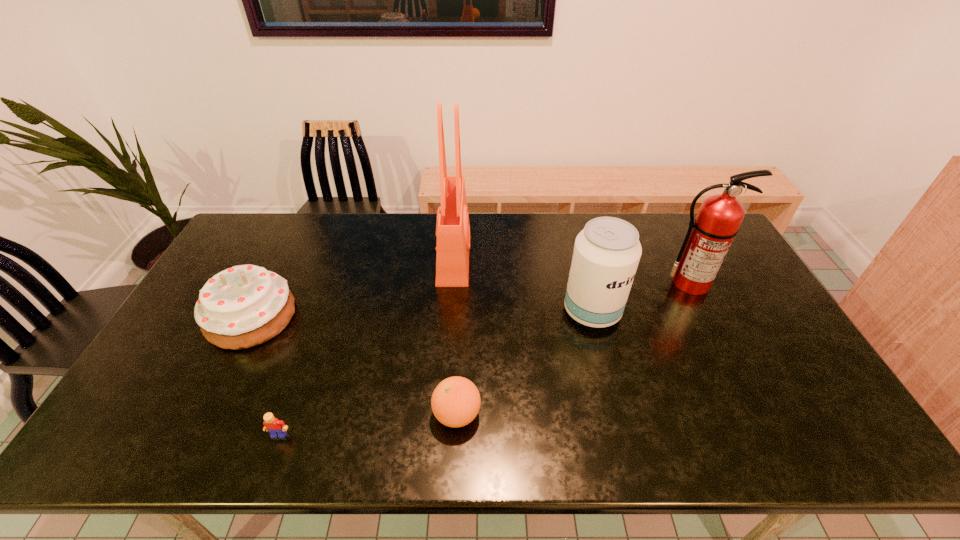
This screenshot has width=960, height=540. Identify the location of blank area located on the logo side of the tote bag. (538, 255).

Identify the location of vacant position located 0.370m at the nozzle of the fire extinguisher. (750, 401).

Where is `vacant space located on the back of the fourth shortest object`? This screenshot has height=540, width=960. vacant space located on the back of the fourth shortest object is located at coordinates (584, 276).

This screenshot has width=960, height=540. In order to click on free space located 0.080m on the back of the cake in this screenshot , I will do 276,270.

Where is `vacant space positioned 0.130m on the back of the fifth tallest object`? The width and height of the screenshot is (960, 540). vacant space positioned 0.130m on the back of the fifth tallest object is located at coordinates (460, 352).

Locate an element on the screen. The height and width of the screenshot is (540, 960). object at the far edge is located at coordinates [452, 226].

You are a GUI agent. You are given a task and a screenshot of the screen. Output one action in this format:
    pyautogui.click(x=<x>, y=<y>)
    Task: Click on the orange located in the near edge section of the desktop
    Image resolution: width=960 pixels, height=540 pixels.
    Given the screenshot: What is the action you would take?
    pos(455,402)

At what (x,y) coordinates should I click in order to perform the action: click on Lego that is at the near edge. Please return your answer as a coordinate pair (x, y). The image size is (960, 540). Looking at the image, I should click on (277, 428).

This screenshot has height=540, width=960. What are the coordinates of `object that is positioned at the left edge` in the screenshot? It's located at (243, 306).

The height and width of the screenshot is (540, 960). Identify the location of object present at the right edge. (709, 236).